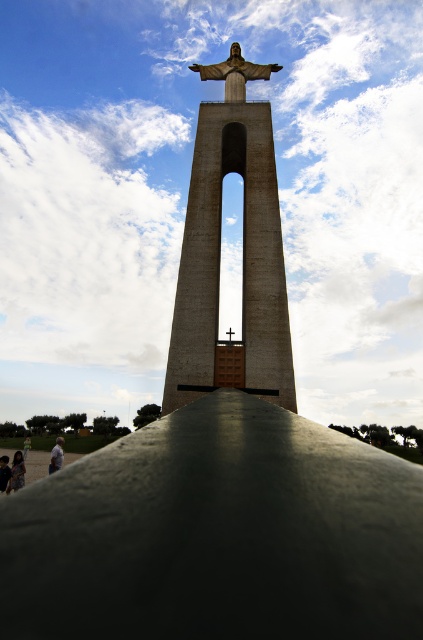
You are a tourist standing at the base of the monument and notice two items in the foreground. Which one is taller between the dark gray concrete person at lower left and the light brown wooden stick at lower left?

The dark gray concrete person at lower left is taller than the light brown wooden stick at lower left.

You are standing in front of the statue and want to take a photo of the light brown shirt at lower left. Where exactly should you position yourself to capture it in the frame?

The light brown shirt at lower left is located at point (57,456), so you should position yourself in the lower left area of the scene to capture it in the frame.

You are standing in front of the statue and notice a light brown shirt at lower left and a dark skin person at lower left. Which one appears taller in the image?

The light brown shirt at lower left is taller than dark skin person at lower left.